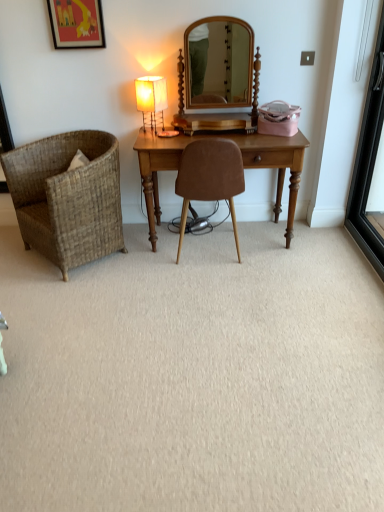
Where is `vacant space in front of woven brown chair at left, arranged as the second chair when viewed from the right`? The width and height of the screenshot is (384, 512). vacant space in front of woven brown chair at left, arranged as the second chair when viewed from the right is located at coordinates (79, 294).